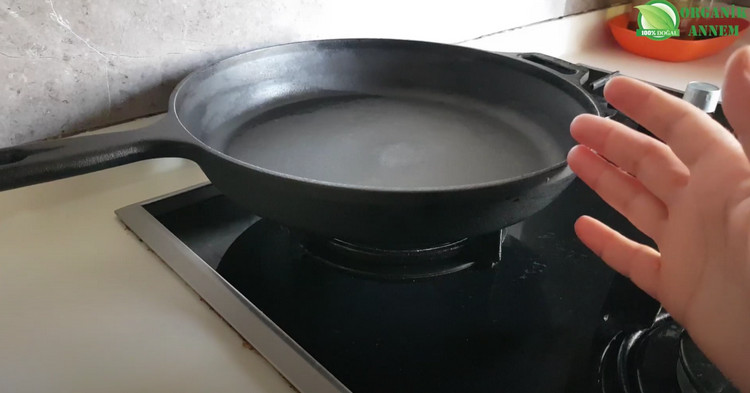
This screenshot has height=393, width=750. What are the coordinates of `white countertop on left side of stove` in the screenshot? It's located at (64, 291), (91, 334).